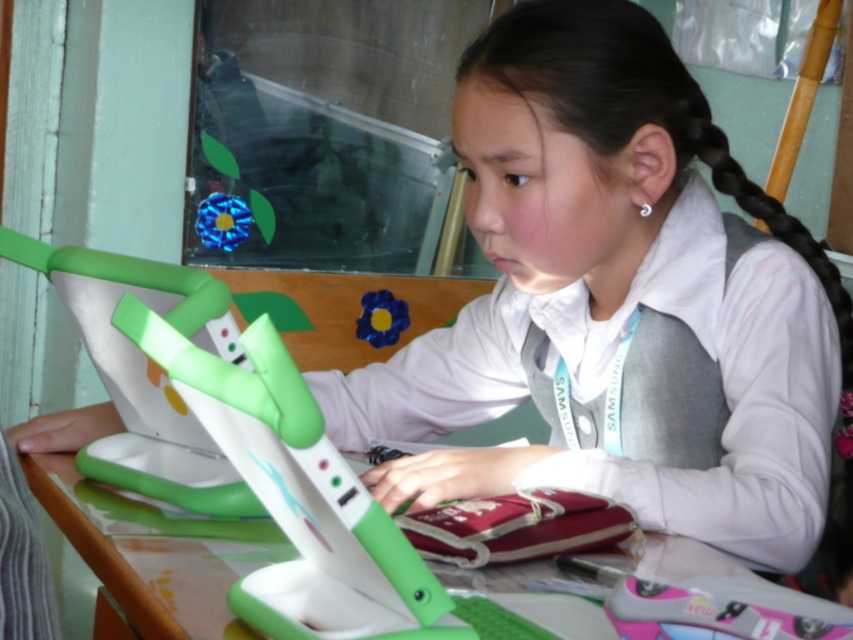
You are standing in front of the table in the image. Where is the wooden table at lower center located relative to the point marked at coordinates (100, 548)?

The wooden table at lower center is exactly at the point marked by the coordinates (100, 548).

You are a photographer trying to capture a shot of the wooden table at lower center and the black hair at upper right. Based on their positions, which object should you focus on first if you want to include both in your frame?

The wooden table at lower center should be focused on first since it is positioned to the left of the black hair at upper right, allowing both to be included in the frame when starting from the left.

You are a student trying to place a 15 cm tall textbook on the wooden table at lower center. Considering the height of the black hair at upper right, can the textbook be placed there without it touching the hair?

The wooden table at lower center has a lesser height compared to the black hair at upper right. Since the textbook is 15 cm tall, it may still be placed on the table as the table is lower, so the textbook won